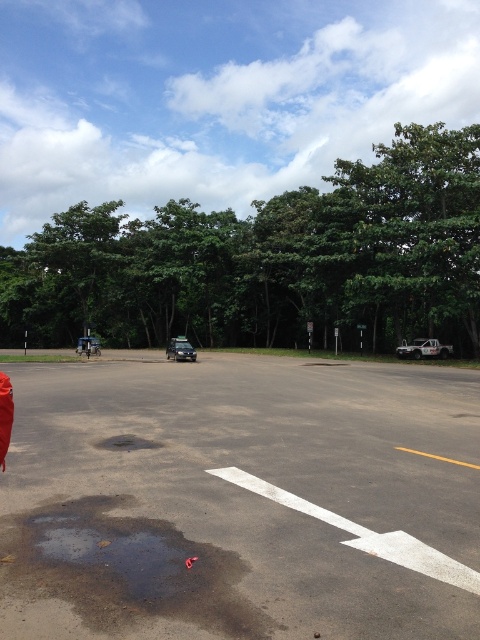
Question: In this image, where is gray asphalt parking lot at center located relative to brown matte puddle at lower center?

Choices:
 (A) above
 (B) below

Answer: (B)

Question: Which point appears farthest from the camera in this image?

Choices:
 (A) (6, 432)
 (B) (69, 500)
 (C) (451, 349)

Answer: (C)

Question: Does white glossy car at lower right come in front of green matte car at center?

Choices:
 (A) no
 (B) yes

Answer: (A)

Question: Which of these objects is positioned farthest from the gray asphalt parking lot at center?

Choices:
 (A) green matte car at center
 (B) matte red jacket at lower left

Answer: (A)

Question: In this image, where is gray asphalt parking lot at center located relative to brown matte puddle at center?

Choices:
 (A) right
 (B) left

Answer: (A)

Question: Considering the real-world distances, which object is farthest from the brown matte puddle at center?

Choices:
 (A) white glossy car at lower right
 (B) metallic blue truck at left

Answer: (B)